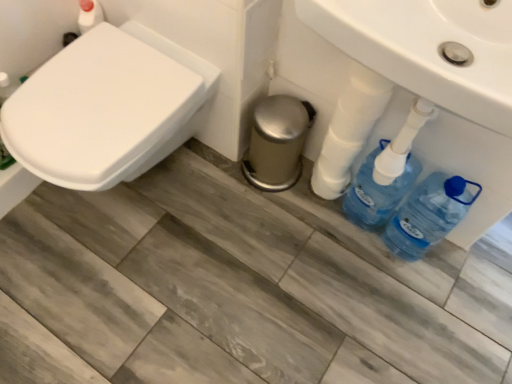
Question: Considering the relative positions of blue plastic bottle at lower right and white glossy sink at center in the image provided, is blue plastic bottle at lower right behind white glossy sink at center?

Choices:
 (A) yes
 (B) no

Answer: (A)

Question: From a real-world perspective, does blue plastic bottle at lower right stand above white glossy sink at center?

Choices:
 (A) yes
 (B) no

Answer: (B)

Question: Considering the relative sizes of blue plastic bottle at lower right and white glossy sink at center in the image provided, is blue plastic bottle at lower right smaller than white glossy sink at center?

Choices:
 (A) no
 (B) yes

Answer: (B)

Question: Can you confirm if blue plastic bottle at lower right is positioned to the left of white glossy sink at center?

Choices:
 (A) no
 (B) yes

Answer: (A)

Question: From a real-world perspective, is blue plastic bottle at lower right beneath white glossy sink at center?

Choices:
 (A) yes
 (B) no

Answer: (A)

Question: Does blue plastic bottle at lower right appear on the right side of white glossy sink at center?

Choices:
 (A) no
 (B) yes

Answer: (B)

Question: Considering the relative positions of white glossy toilet at left and blue plastic bottles at lower right in the image provided, is white glossy toilet at left to the right of blue plastic bottles at lower right from the viewer's perspective?

Choices:
 (A) yes
 (B) no

Answer: (B)

Question: Is white glossy toilet at left shorter than blue plastic bottles at lower right?

Choices:
 (A) yes
 (B) no

Answer: (B)

Question: Is white glossy toilet at left placed right next to blue plastic bottles at lower right?

Choices:
 (A) yes
 (B) no

Answer: (B)

Question: Is white glossy toilet at left located outside blue plastic bottles at lower right?

Choices:
 (A) no
 (B) yes

Answer: (B)

Question: Can you confirm if white glossy toilet at left is positioned to the left of blue plastic bottles at lower right?

Choices:
 (A) yes
 (B) no

Answer: (A)

Question: Is white glossy toilet at left facing towards blue plastic bottles at lower right?

Choices:
 (A) no
 (B) yes

Answer: (A)

Question: Is white glossy sink at center behind white glossy toilet at left?

Choices:
 (A) no
 (B) yes

Answer: (A)